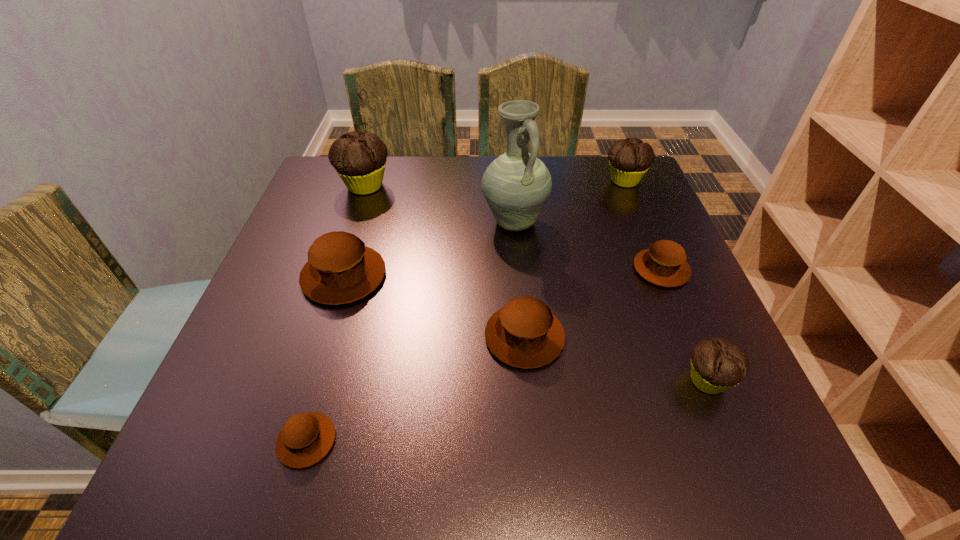
In order to click on pitcher positioned at the far edge in this screenshot , I will do `click(516, 185)`.

The image size is (960, 540). What are the coordinates of `object located at the near edge` in the screenshot? It's located at (306, 438).

Locate an element on the screen. The image size is (960, 540). object that is at the far left corner is located at coordinates (359, 159).

The image size is (960, 540). In order to click on object present at the near left corner in this screenshot , I will do `click(306, 438)`.

In order to click on object that is positioned at the far right corner in this screenshot , I will do `click(629, 159)`.

Identify the location of free space at the far edge. [x=433, y=181].

You are a GUI agent. You are given a task and a screenshot of the screen. Output one action in this format:
    pyautogui.click(x=<x>, y=<y>)
    Task: Click on the free location at the near edge
    Image resolution: width=960 pixels, height=540 pixels.
    Given the screenshot: What is the action you would take?
    pyautogui.click(x=573, y=481)

In the image, there is a desktop. Where is `vacant region at the left edge`? vacant region at the left edge is located at coordinates (299, 339).

In the image, there is a desktop. In order to click on free region at the right edge in this screenshot , I will do `click(656, 206)`.

You are a GUI agent. You are given a task and a screenshot of the screen. Output one action in this format:
    pyautogui.click(x=<x>, y=<y>)
    Task: Click on the vacant position at the near left corner of the desktop
    The height and width of the screenshot is (540, 960).
    Given the screenshot: What is the action you would take?
    pyautogui.click(x=220, y=436)